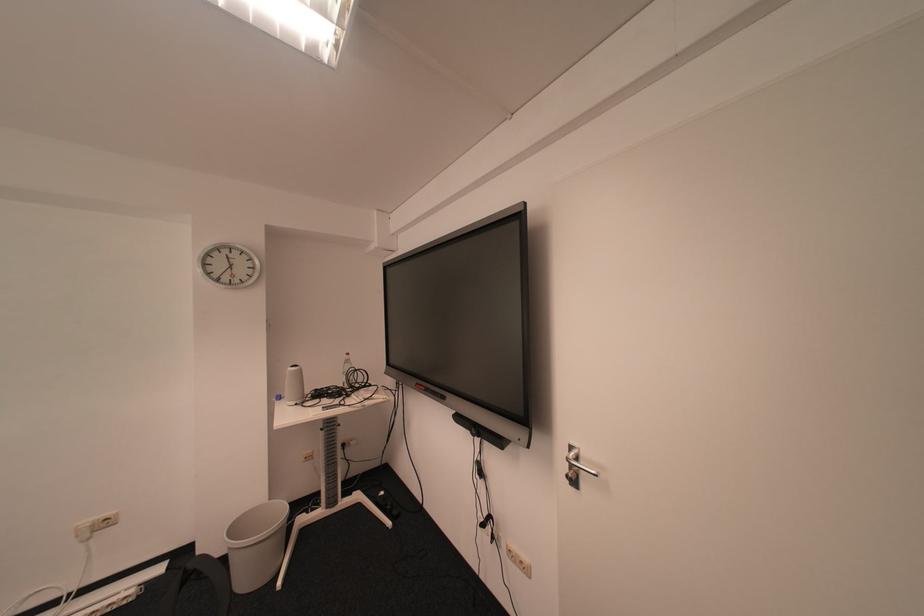
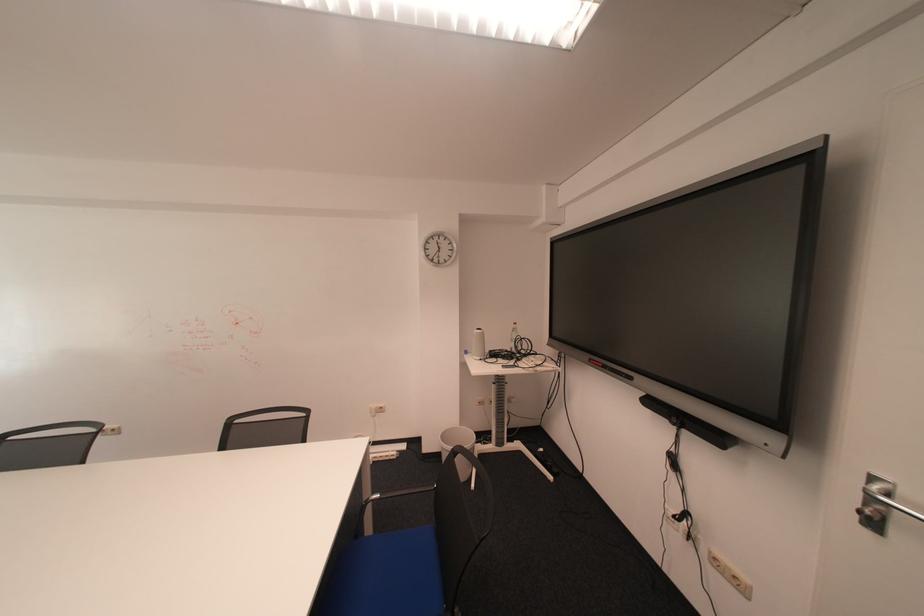
In the second image, find the point that corresponds to pixel 287 402 in the first image.

(477, 355)